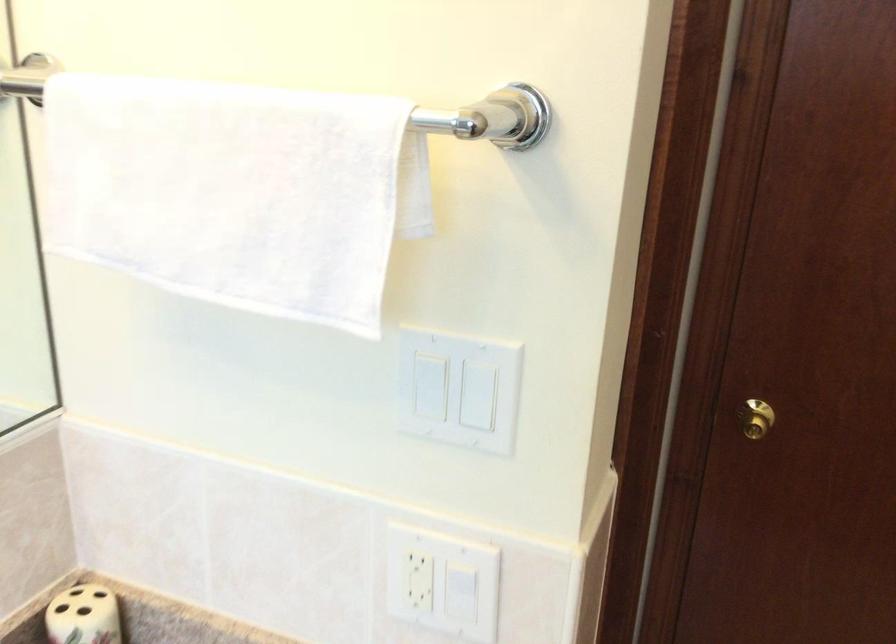
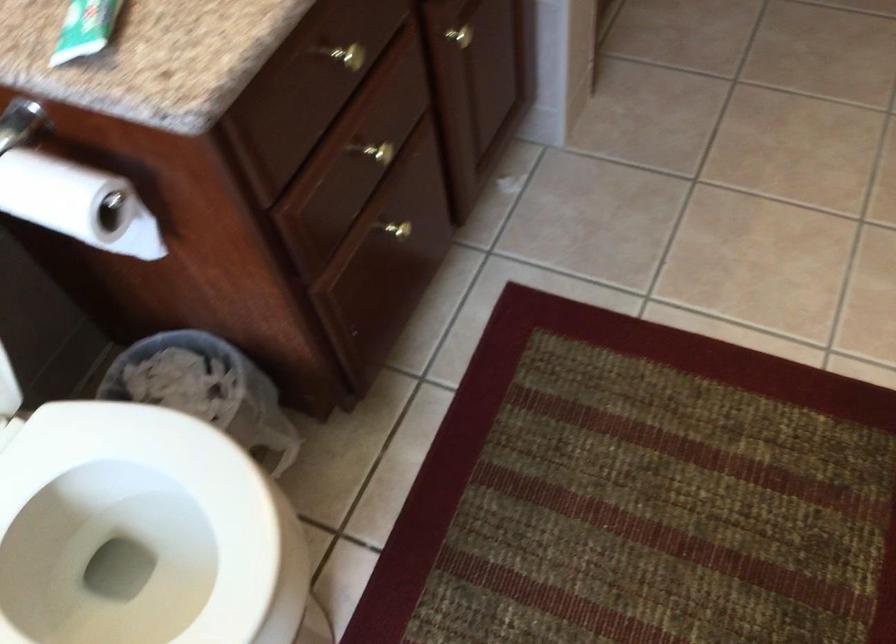
Question: Based on the continuous images, in which direction is the camera rotating? Reply with the corresponding letter.

Choices:
 (A) Left
 (B) Right
 (C) Up
 (D) Down

Answer: (D)